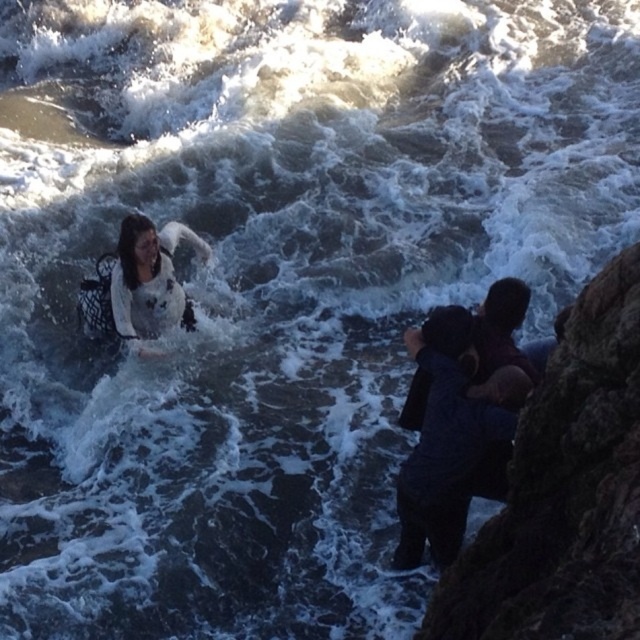
You are a photographer trying to capture the waves crashing against the rocks. You have a green mossy rock at right and a dark blue fabric at right in your frame. Which object should you focus on if you want to emphasize a larger subject in your composition?

The green mossy rock at right has a larger size compared to the dark blue fabric at right, so focusing on it will emphasize a larger subject in your composition.

Consider the image. You are a photographer trying to capture a wide shot of the green mossy rock at right and the dark blue fabric at right. Your camera can only focus on objects within a 3 feet range. Can both objects be in focus at the same time?

The green mossy rock at right and dark blue fabric at right are 3.64 feet apart. Since the camera can only focus within a 3 feet range, the distance between them exceeds the focus range. Therefore, both objects cannot be in focus simultaneously.

You are standing on the rocky outcrop at the right side of the image. You want to move to the green mossy rock at point (x=564, y=492). Is the path between you and the green mossy rock clear?

The green mossy rock at right is located at point (x=564, y=492), so the path between you and the green mossy rock is clear.